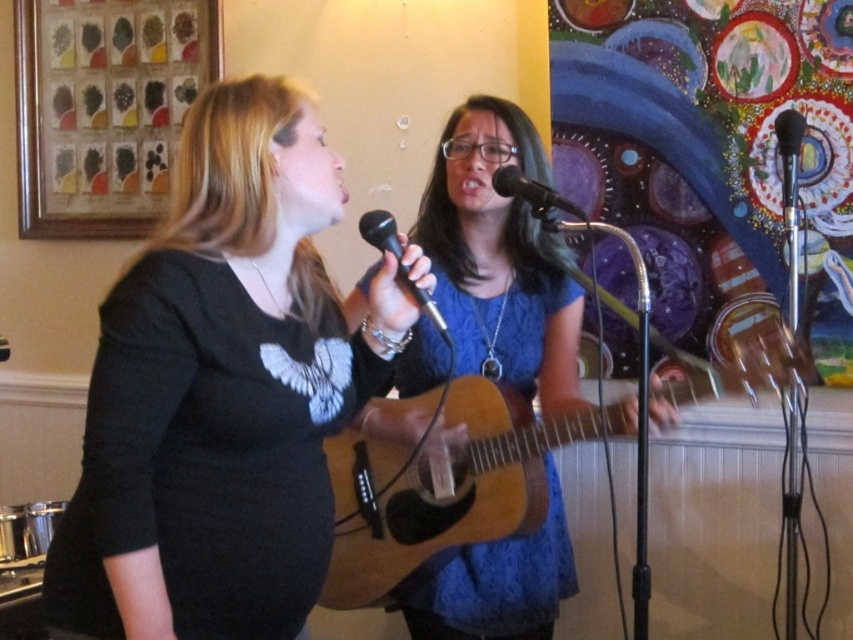
You are a photographer trying to capture a closeup of the black matte microphone at center. You want to ensure the black matte shirt at center does not block the microphone in the photo. Based on the scene, can you position yourself in a way that the microphone is visible without the shirt blocking it?

The black matte shirt at center is positioned on the left side of the black matte microphone at center. To avoid the shirt blocking the microphone, position yourself to the right side of the microphone so that the shirt is out of frame or to the left, allowing the microphone to be clearly visible.

You are a photographer positioned at the origin point of the coordinate system. You want to take a photo of the black matte shirt at center. What are the coordinates where you should aim your camera?

The coordinates to aim the camera are at point (221,392).

You are a photographer setting up for a live performance. You need to position a spotlight so it shines directly on both the black matte shirt at center and the black plastic microphone at center. Based on their positions, which one should the spotlight be aimed lower to illuminate?

The spotlight should be aimed lower to illuminate the black matte shirt at center because it is positioned below the black plastic microphone at center.